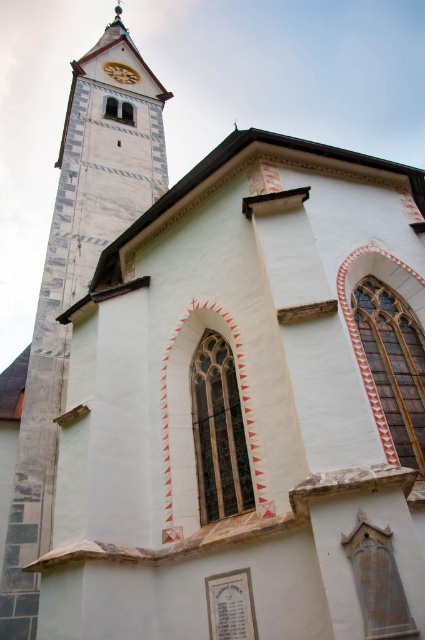
Is speckled stone tower at left above wooden clock face at upper center?

No.

Does speckled stone tower at left have a smaller size compared to wooden clock face at upper center?

Actually, speckled stone tower at left might be larger than wooden clock face at upper center.

Is point (130, 84) in front of point (112, 72)?

Yes, it is.

Locate an element on the screen. The width and height of the screenshot is (425, 640). speckled stone tower at left is located at coordinates (76, 282).